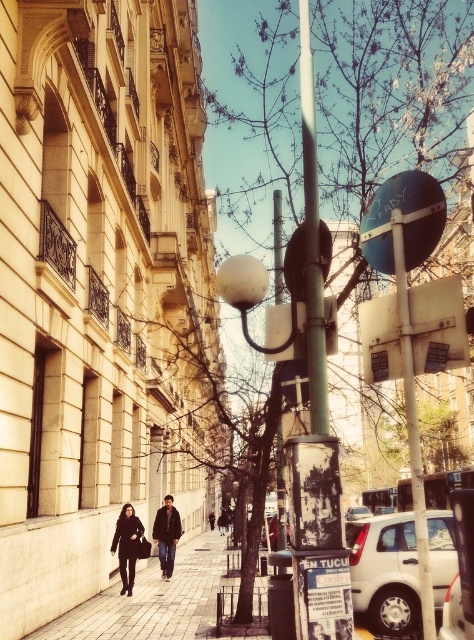
What do you see at coordinates (311, 237) in the screenshot? Image resolution: width=474 pixels, height=640 pixels. I see `green matte pole at center` at bounding box center [311, 237].

Consider the image. Which is more to the right, green matte pole at center or dark brown leather jacket at center?

green matte pole at center is more to the right.

Describe the element at coordinates (311, 237) in the screenshot. I see `green matte pole at center` at that location.

What are the coordinates of `green matte pole at center` in the screenshot? It's located at (311, 237).

What do you see at coordinates (128, 545) in the screenshot? This screenshot has height=640, width=474. I see `dark brown leather jacket at lower center` at bounding box center [128, 545].

Can you confirm if dark brown leather jacket at lower center is thinner than dark brown leather jacket at center?

No, dark brown leather jacket at lower center is not thinner than dark brown leather jacket at center.

The width and height of the screenshot is (474, 640). Identify the location of dark brown leather jacket at lower center. (128, 545).

Where is `dark brown leather jacket at lower center`? dark brown leather jacket at lower center is located at coordinates (128, 545).

Is green matte pole at center above black leather coat at lower left?

Yes, green matte pole at center is above black leather coat at lower left.

Who is positioned more to the right, green matte pole at center or black leather coat at lower left?

green matte pole at center

Who is more distant from viewer, (316, 205) or (119, 538)?

The point (119, 538) is behind.

You are a GUI agent. You are given a task and a screenshot of the screen. Output one action in this format:
    pyautogui.click(x=<x>, y=<y>)
    Task: Click on the green matte pole at center
    This screenshot has height=640, width=474.
    Given the screenshot: What is the action you would take?
    tap(311, 237)